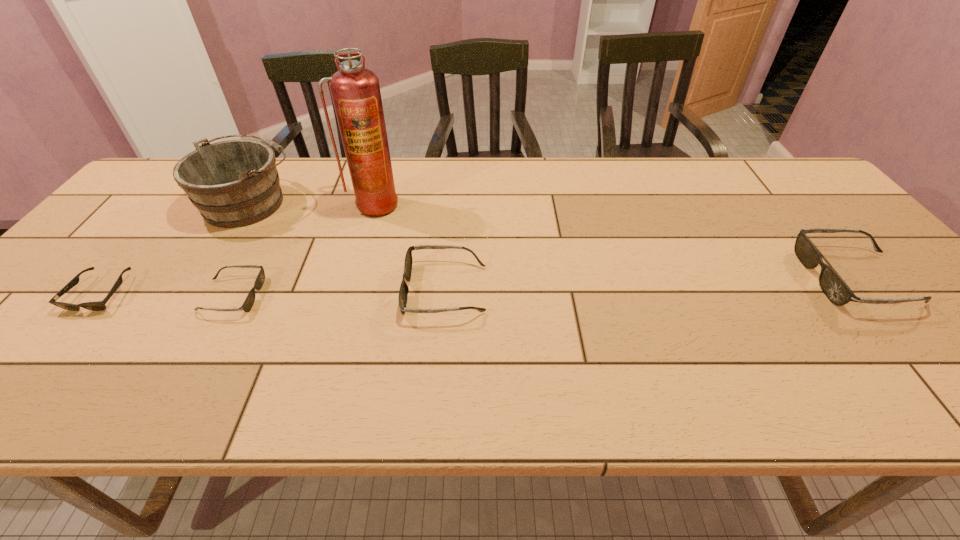
Locate an element on the screen. The image size is (960, 540). vacant position for inserting another sunglasses evenly is located at coordinates (653, 284).